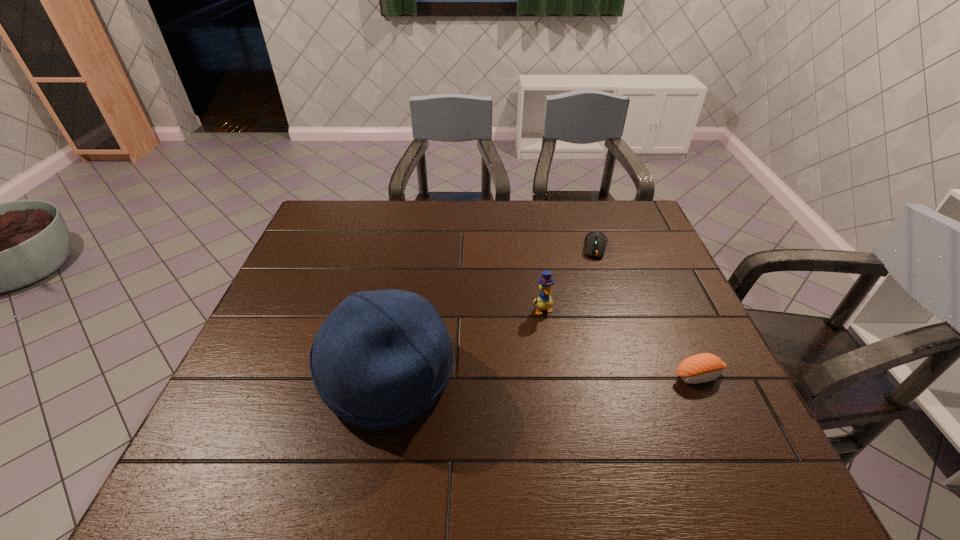
This screenshot has width=960, height=540. In order to click on the tallest object in this screenshot , I will do `click(382, 358)`.

In order to click on skullcap in this screenshot , I will do `click(382, 358)`.

Identify the location of the second shortest object. This screenshot has width=960, height=540. (704, 367).

In order to click on sushi in this screenshot , I will do `click(704, 367)`.

Identify the location of the second farthest object. This screenshot has width=960, height=540. (544, 301).

The image size is (960, 540). What are the coordinates of `duckling` in the screenshot? It's located at (544, 301).

The width and height of the screenshot is (960, 540). Find the location of `computer equipment`. computer equipment is located at coordinates (595, 242).

I want to click on the farthest object, so click(x=595, y=242).

This screenshot has height=540, width=960. I want to click on free space located 0.230m on the right of the skullcap, so click(x=555, y=376).

This screenshot has height=540, width=960. Identify the location of vacant area situated on the left of the rightmost object. (611, 376).